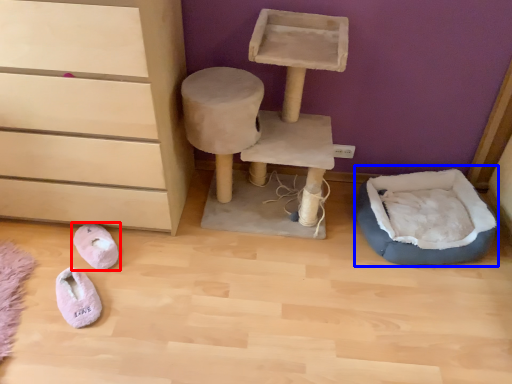
Question: Which object is further to the camera taking this photo, footwear (highlighted by a red box) or bean bag chair (highlighted by a blue box)?

Choices:
 (A) footwear
 (B) bean bag chair

Answer: (A)